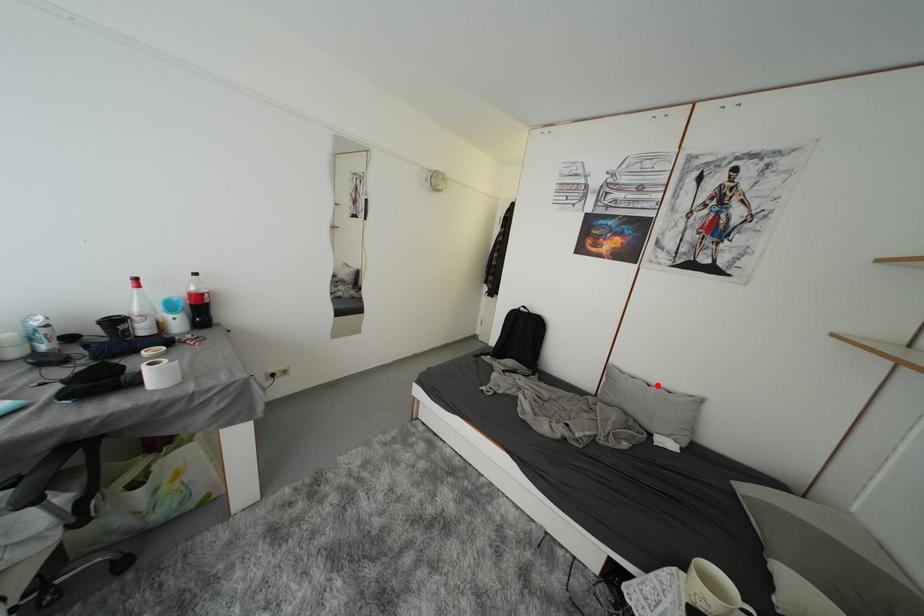
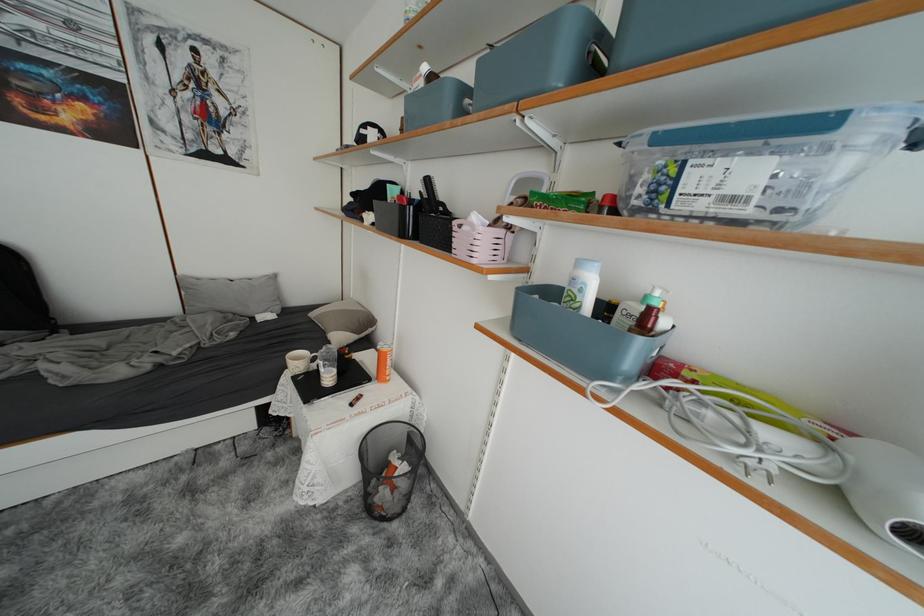
Where in the second image is the point corresponding to the highlighted location from the first image?

(238, 281)